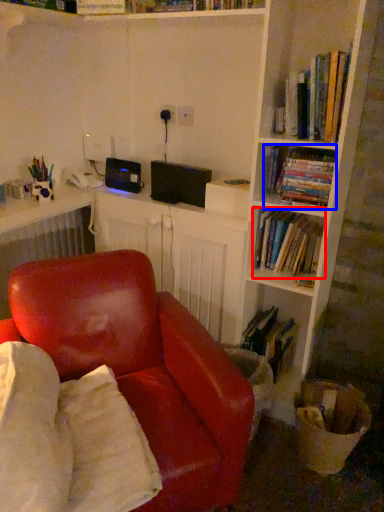
Question: Which object is further to the camera taking this photo, book (highlighted by a red box) or book (highlighted by a blue box)?

Choices:
 (A) book
 (B) book

Answer: (A)